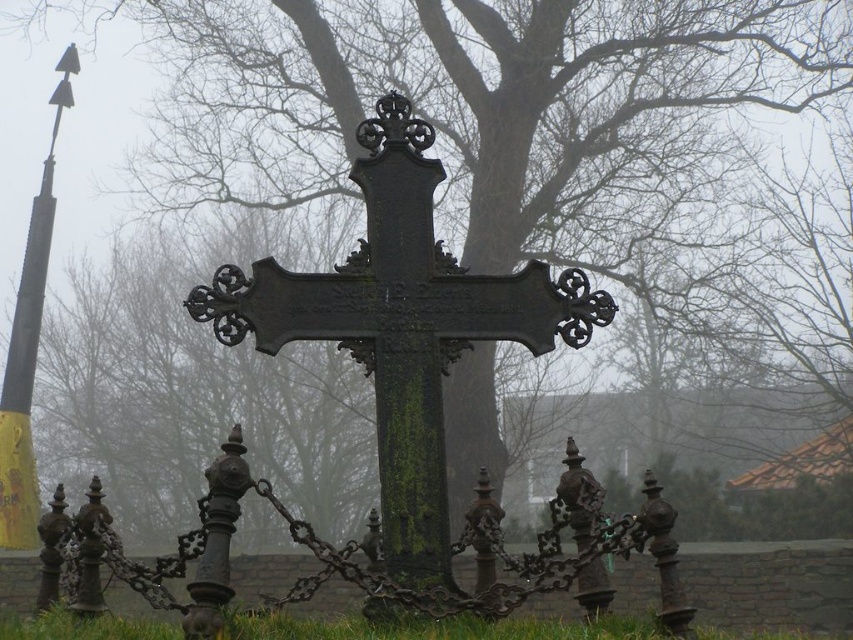
You are standing in the cemetery looking at the weathered black cross. There are two points marked in the image. From your perspective, which point is closer to you, point (367, 198) or point (302, 596)?

A: Point (367, 198) is closer to you than point (302, 596).

You are a photographer trying to capture the green mossy metal cross at center and the yellow painted metal pole at left. If you want to frame both objects in your shot, which object should you position closer to the center of the photo to ensure both fit within the frame?

The green mossy metal cross at center is wider than the yellow painted metal pole at left, so positioning the cross closer to the center will allow both objects to fit within the frame while accommodating its greater width.

In the scene shown: You are standing in a cemetery and see the green mossy metal cross at center and the rusty metal fence at center. Which object is nearer to you?

The green mossy metal cross at center is closer to the viewer than the rusty metal fence at center.